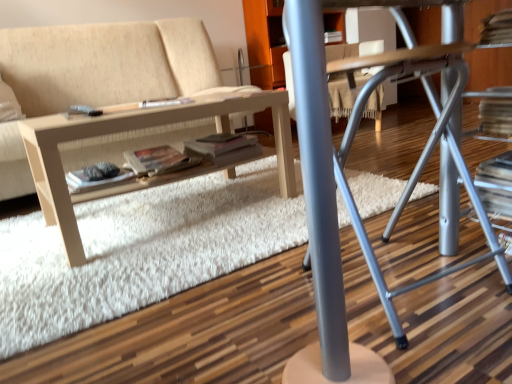
Question: Is matte gray magazine at center positioned in front of white shag rug at center?

Choices:
 (A) no
 (B) yes

Answer: (A)

Question: Does matte gray magazine at center have a smaller size compared to white shag rug at center?

Choices:
 (A) no
 (B) yes

Answer: (B)

Question: From a real-world perspective, is matte gray magazine at center positioned under white shag rug at center based on gravity?

Choices:
 (A) no
 (B) yes

Answer: (A)

Question: Can you confirm if matte gray magazine at center is bigger than white shag rug at center?

Choices:
 (A) yes
 (B) no

Answer: (B)

Question: Is matte gray magazine at center not inside white shag rug at center?

Choices:
 (A) yes
 (B) no

Answer: (A)

Question: Is metallic gray computer desk at center to the left or to the right of matte paper paperback book at center, the second paperback book viewed from the left, in the image?

Choices:
 (A) right
 (B) left

Answer: (A)

Question: From a real-world perspective, relative to matte paper paperback book at center, the second paperback book viewed from the left, is metallic gray computer desk at center vertically above or below?

Choices:
 (A) below
 (B) above

Answer: (B)

Question: Relative to matte paper paperback book at center, the second paperback book viewed from the left, is metallic gray computer desk at center in front or behind?

Choices:
 (A) behind
 (B) front

Answer: (B)

Question: Is point (347, 130) positioned closer to the camera than point (168, 168)?

Choices:
 (A) closer
 (B) farther

Answer: (A)

Question: Is light wood/texture table at lower left taller or shorter than matte paper paperback book at center, the first paperback book viewed from the right?

Choices:
 (A) short
 (B) tall

Answer: (B)

Question: From the image's perspective, is light wood/texture table at lower left above or below matte paper paperback book at center, the second paperback book viewed from the left?

Choices:
 (A) below
 (B) above

Answer: (B)

Question: From a real-world perspective, is light wood/texture table at lower left physically located above or below matte paper paperback book at center, the second paperback book viewed from the left?

Choices:
 (A) above
 (B) below

Answer: (B)

Question: Is light wood/texture table at lower left wider or thinner than matte paper paperback book at center, the first paperback book viewed from the right?

Choices:
 (A) thin
 (B) wide

Answer: (B)

Question: From the image's perspective, is metallic gray computer desk at center located above or below beige fabric couch at center?

Choices:
 (A) below
 (B) above

Answer: (A)

Question: In terms of size, does metallic gray computer desk at center appear bigger or smaller than beige fabric couch at center?

Choices:
 (A) small
 (B) big

Answer: (A)